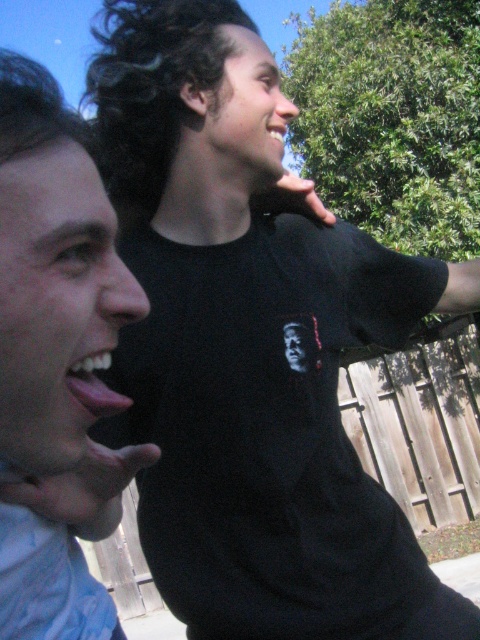
Does point (68, 324) come in front of point (288, 205)?

That is True.

Does point (38, 532) lie in front of point (304, 182)?

Yes.

Find the location of a particular element. blue fabric mouth at left is located at coordinates (56, 358).

Between point (72, 481) and point (308, 189), which one is positioned behind?

Positioned behind is point (308, 189).

Is matte black hand at lower left further to camera compared to black matte phone at upper center?

No, matte black hand at lower left is in front of black matte phone at upper center.

Does point (23, 497) come closer to viewer compared to point (312, 205)?

Yes, point (23, 497) is closer to viewer.

You are a GUI agent. You are given a task and a screenshot of the screen. Output one action in this format:
    pyautogui.click(x=<x>, y=<y>)
    Task: Click on the matte black hand at lower left
    The image size is (480, 640).
    Given the screenshot: What is the action you would take?
    pyautogui.click(x=82, y=483)

Does matte black hand at lower left appear over black matte wristband at upper right?

Actually, matte black hand at lower left is below black matte wristband at upper right.

Does matte black hand at lower left appear on the right side of black matte wristband at upper right?

No, matte black hand at lower left is not to the right of black matte wristband at upper right.

Is point (60, 493) farther from viewer compared to point (447, 298)?

No, (60, 493) is closer to viewer.

Where is `matte black hand at lower left`? matte black hand at lower left is located at coordinates (82, 483).